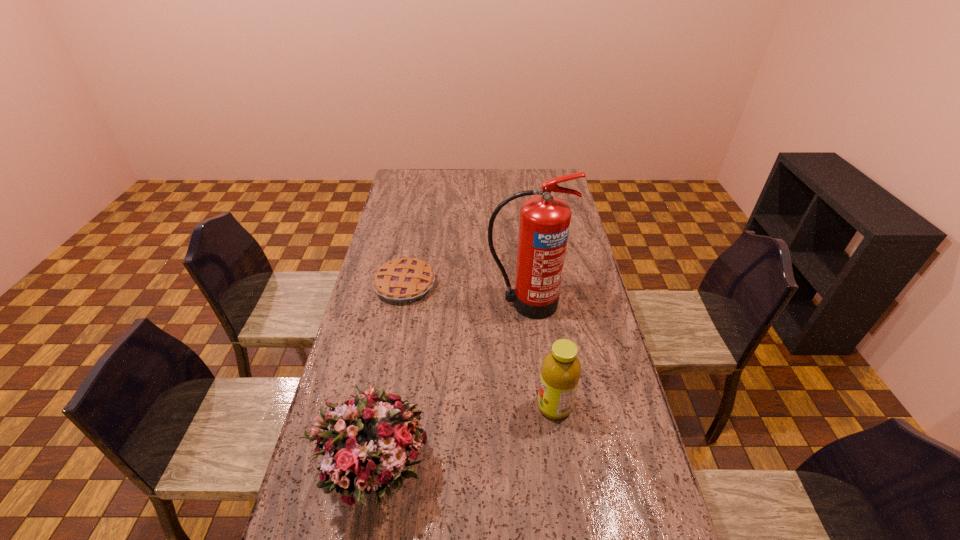
You are a GUI agent. You are given a task and a screenshot of the screen. Output one action in this format:
    pyautogui.click(x=<x>, y=<y>)
    Task: Click on the bouquet at the left edge
    This screenshot has width=960, height=540.
    Given the screenshot: What is the action you would take?
    pyautogui.click(x=371, y=436)

Where is `pie at the left edge`? The image size is (960, 540). pie at the left edge is located at coordinates (402, 280).

At what (x,y) coordinates should I click in order to perform the action: click on object located in the right edge section of the desktop. Please return your answer as a coordinate pair (x, y). The width and height of the screenshot is (960, 540). Looking at the image, I should click on coord(544,224).

This screenshot has height=540, width=960. I want to click on vacant region at the left edge, so click(x=385, y=237).

Where is `free space at the right edge of the desktop`? free space at the right edge of the desktop is located at coordinates (616, 386).

In the image, there is a desktop. In order to click on vacant space at the far left corner in this screenshot , I will do `click(399, 183)`.

Locate an element on the screen. vacant area that lies between the shortest object and the tallest object is located at coordinates (466, 294).

Where is `empty space between the tallest object and the fruit juice`? The height and width of the screenshot is (540, 960). empty space between the tallest object and the fruit juice is located at coordinates (540, 355).

This screenshot has width=960, height=540. I want to click on free space between the bouquet and the fruit juice, so click(x=463, y=438).

At what (x,y) coordinates should I click in order to perform the action: click on vacant space that's between the fruit juice and the fire extinguisher. Please return your answer as a coordinate pair (x, y). Looking at the image, I should click on (540, 355).